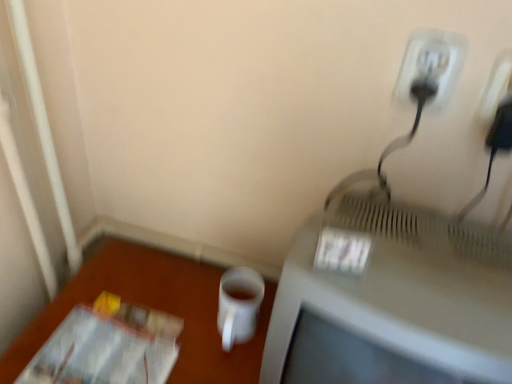
I want to click on empty space that is ontop of white matte cup at lower right (from a real-world perspective), so click(170, 306).